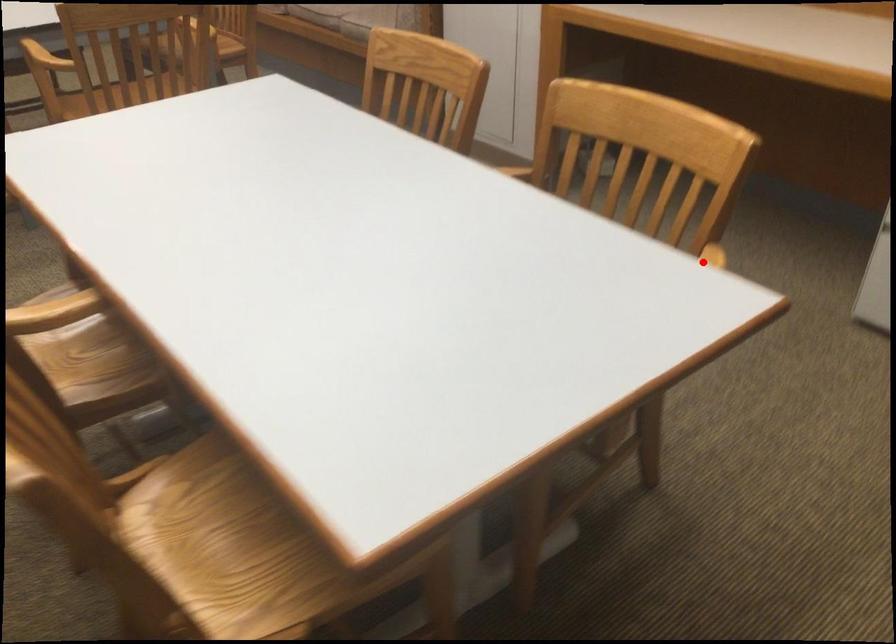
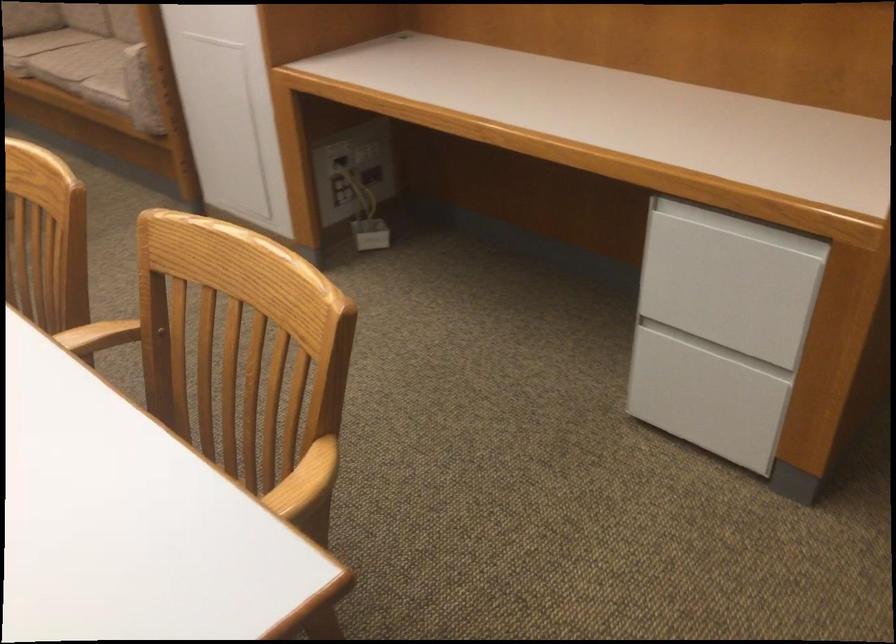
Question: I am providing you with two images of the same scene from different viewpoints. Image1 has a red point marked. In image2, the corresponding 3D location appears at what relative position? Reply with the corresponding letter.

Choices:
 (A) Closer
 (B) Farther

Answer: (A)